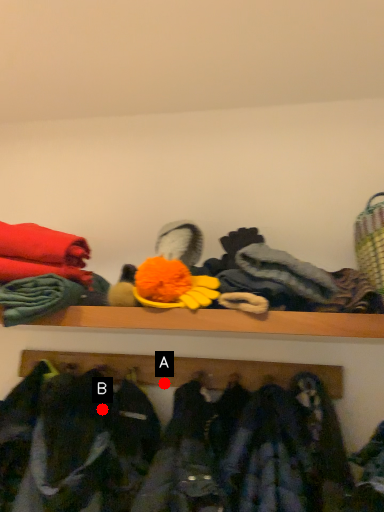
Question: Two points are circled on the image, labeled by A and B beside each circle. Which point is closer to the camera taking this photo?

Choices:
 (A) A is closer
 (B) B is closer

Answer: (B)